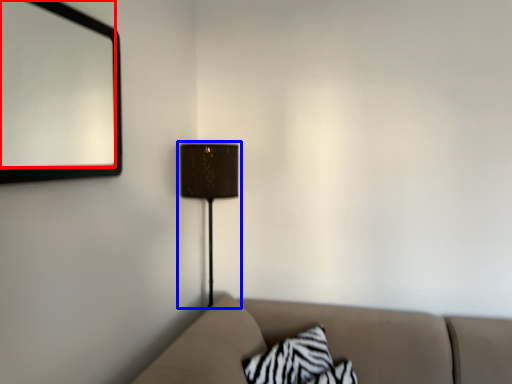
Question: Which object is closer to the camera taking this photo, mirror (highlighted by a red box) or lamp (highlighted by a blue box)?

Choices:
 (A) mirror
 (B) lamp

Answer: (A)